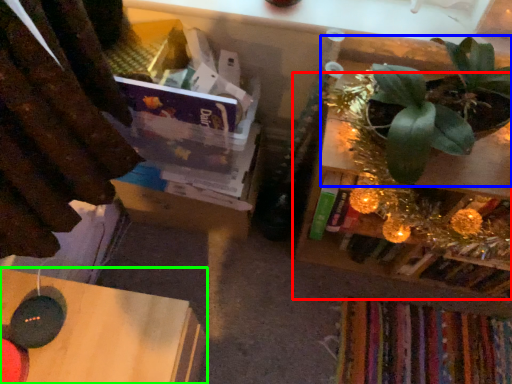
Question: Considering the real-world distances, which object is farthest from shelf (highlighted by a red box)? houseplant (highlighted by a blue box) or table (highlighted by a green box)?

Choices:
 (A) houseplant
 (B) table

Answer: (B)